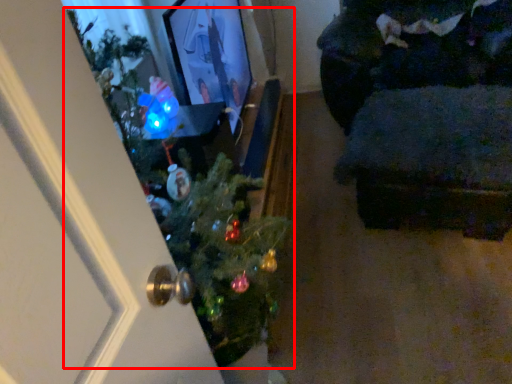
Question: From the image, what is the correct spatial relationship of christmas tree (annotated by the red box) in relation to furniture?

Choices:
 (A) right
 (B) left

Answer: (B)